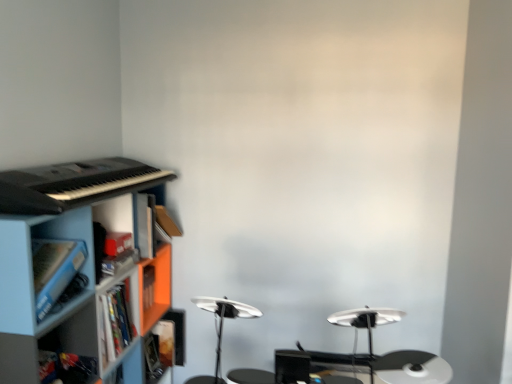
Question: Should I look upward or downward to see orange matte cabinet at left, the 2th cabinet when ordered from front to back?

Choices:
 (A) down
 (B) up

Answer: (A)

Question: Is orange matte cabinet at left, the first cabinet positioned from the back, far away from blue plastic cabinet at lower left, which is the second cabinet from back to front?

Choices:
 (A) yes
 (B) no

Answer: (B)

Question: Is blue plastic cabinet at lower left, which is the second cabinet from back to front, at the back of orange matte cabinet at left, the first cabinet positioned from the back?

Choices:
 (A) no
 (B) yes

Answer: (A)

Question: Does orange matte cabinet at left, the first cabinet positioned from the back, have a greater height compared to blue plastic cabinet at lower left, which is the second cabinet from back to front?

Choices:
 (A) no
 (B) yes

Answer: (A)

Question: Is orange matte cabinet at left, the 2th cabinet when ordered from front to back, shorter than blue plastic cabinet at lower left, which is the second cabinet from back to front?

Choices:
 (A) yes
 (B) no

Answer: (A)

Question: Does orange matte cabinet at left, the 2th cabinet when ordered from front to back, have a greater width compared to blue plastic cabinet at lower left, which ranks as the 1th cabinet in front-to-back order?

Choices:
 (A) no
 (B) yes

Answer: (A)

Question: Considering the relative positions of orange matte cabinet at left, the first cabinet positioned from the back, and blue plastic cabinet at lower left, which is the second cabinet from back to front, in the image provided, is orange matte cabinet at left, the first cabinet positioned from the back, to the right of blue plastic cabinet at lower left, which is the second cabinet from back to front, from the viewer's perspective?

Choices:
 (A) yes
 (B) no

Answer: (A)

Question: From a real-world perspective, is blue plastic shelf at lower left below orange matte cabinet at left, the first cabinet positioned from the back?

Choices:
 (A) yes
 (B) no

Answer: (A)

Question: Is blue plastic shelf at lower left positioned with its back to orange matte cabinet at left, the 2th cabinet when ordered from front to back?

Choices:
 (A) no
 (B) yes

Answer: (B)

Question: Can you confirm if blue plastic shelf at lower left is wider than orange matte cabinet at left, the first cabinet positioned from the back?

Choices:
 (A) no
 (B) yes

Answer: (B)

Question: Can you confirm if blue plastic shelf at lower left is positioned to the right of orange matte cabinet at left, the 2th cabinet when ordered from front to back?

Choices:
 (A) no
 (B) yes

Answer: (A)

Question: Does blue plastic shelf at lower left have a lesser height compared to orange matte cabinet at left, the first cabinet positioned from the back?

Choices:
 (A) yes
 (B) no

Answer: (B)

Question: Would you consider blue plastic shelf at lower left to be distant from orange matte cabinet at left, the first cabinet positioned from the back?

Choices:
 (A) yes
 (B) no

Answer: (B)

Question: From the image's perspective, does blue plastic shelf at lower left appear higher than hardcover book at lower left?

Choices:
 (A) yes
 (B) no

Answer: (A)